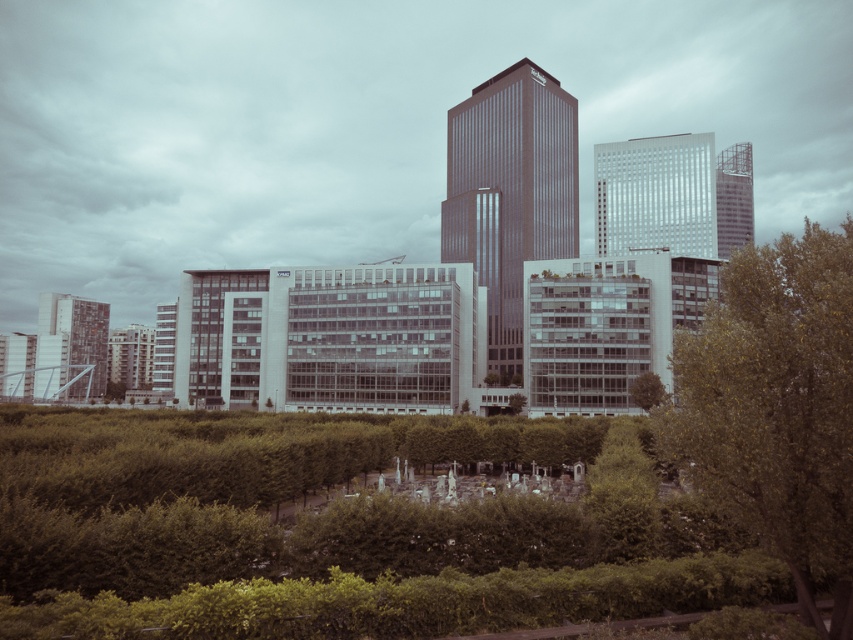
Question: Is smooth glass skyscraper at center to the left of matte gray building at lower left from the viewer's perspective?

Choices:
 (A) yes
 (B) no

Answer: (B)

Question: Among these objects, which one is farthest from the camera?

Choices:
 (A) green leafy tree at center-right
 (B) smooth glass skyscraper at center

Answer: (B)

Question: Observing the image, what is the correct spatial positioning of smooth glass skyscraper at center in reference to white glass building at center?

Choices:
 (A) below
 (B) above

Answer: (A)

Question: Which point is farther from the camera taking this photo?

Choices:
 (A) (51, 364)
 (B) (640, 378)
 (C) (554, 104)
 (D) (735, 177)

Answer: (D)

Question: In this image, where is green leafy tree at center located relative to smooth glass skyscraper at center?

Choices:
 (A) left
 (B) right

Answer: (B)

Question: Which object is farther from the camera taking this photo?

Choices:
 (A) green leafy tree at center
 (B) white glass building at center

Answer: (B)